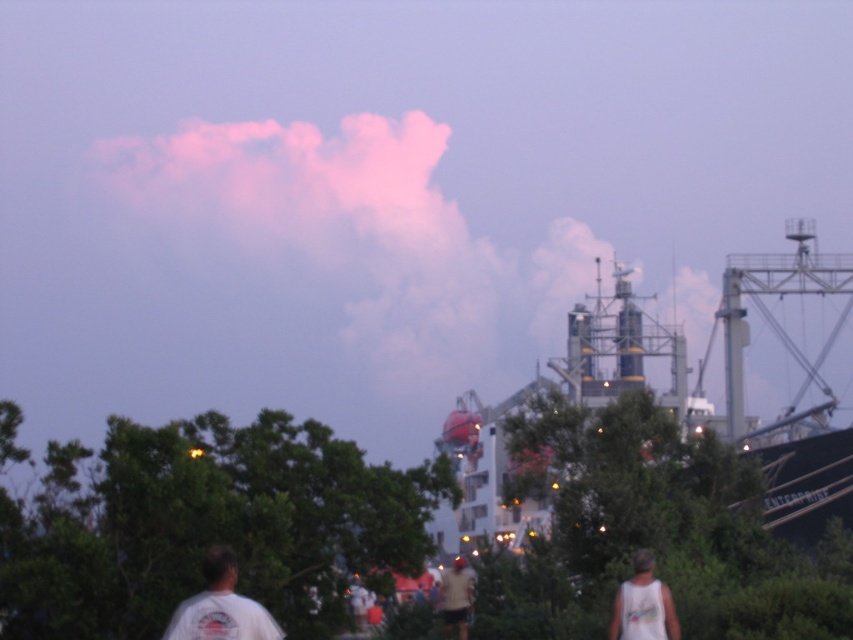
Who is lower down, metallic gray ship at center-right or white matte shirt at center?

white matte shirt at center is lower down.

Does metallic gray ship at center-right appear over white matte shirt at center?

Correct, metallic gray ship at center-right is located above white matte shirt at center.

Does point (579, 390) come behind point (450, 572)?

Yes.

What are the coordinates of `metallic gray ship at center-right` in the screenshot? It's located at (686, 392).

Between point (625, 618) and point (444, 620), which one is positioned behind?

The point (444, 620) is more distant.

The height and width of the screenshot is (640, 853). I want to click on white tank top at lower right, so click(x=643, y=604).

Is white t-shirt at lower left taller than white matte shirt at center?

No, white t-shirt at lower left is not taller than white matte shirt at center.

Who is shorter, white t-shirt at lower left or white matte shirt at center?

With less height is white t-shirt at lower left.

Image resolution: width=853 pixels, height=640 pixels. I want to click on white t-shirt at lower left, so click(219, 605).

This screenshot has width=853, height=640. What are the coordinates of `white t-shirt at lower left` in the screenshot? It's located at (219, 605).